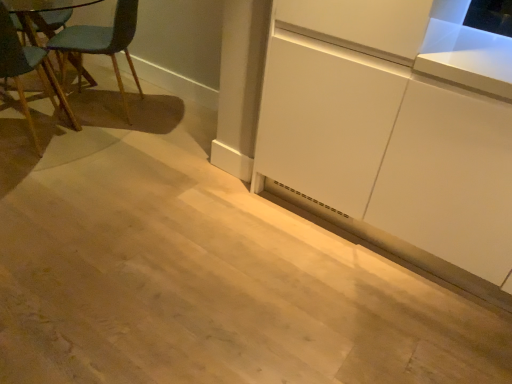
The image size is (512, 384). What do you see at coordinates (386, 140) in the screenshot?
I see `white matte cabinet at lower right` at bounding box center [386, 140].

Identify the location of white matte cabinet at lower right. The height and width of the screenshot is (384, 512). (386, 140).

Identify the location of teal fabric chair at left. (99, 45).

What do you see at coordinates (99, 45) in the screenshot?
I see `teal fabric chair at left` at bounding box center [99, 45].

I want to click on white matte cabinet at lower right, so click(x=386, y=140).

Is teal fabric chair at left to the left of white matte cabinet at lower right from the viewer's perspective?

Yes, teal fabric chair at left is to the left of white matte cabinet at lower right.

Which object is closer to the camera taking this photo, teal fabric chair at left or white matte cabinet at lower right?

white matte cabinet at lower right.

Is point (133, 17) closer to camera compared to point (394, 140)?

No, (133, 17) is further to viewer.

From the image's perspective, between teal fabric chair at left and white matte cabinet at lower right, who is located below?

white matte cabinet at lower right.

From a real-world perspective, relative to white matte cabinet at lower right, is teal fabric chair at left vertically above or below?

teal fabric chair at left is below white matte cabinet at lower right.

Is teal fabric chair at left thinner than white matte cabinet at lower right?

No.

Does teal fabric chair at left have a greater height compared to white matte cabinet at lower right?

In fact, teal fabric chair at left may be shorter than white matte cabinet at lower right.

Is teal fabric chair at left bigger or smaller than white matte cabinet at lower right?

teal fabric chair at left is bigger than white matte cabinet at lower right.

Looking at this image, can we say teal fabric chair at left lies outside white matte cabinet at lower right?

Yes.

Is teal fabric chair at left touching white matte cabinet at lower right?

No, teal fabric chair at left is not making contact with white matte cabinet at lower right.

Is teal fabric chair at left aimed at white matte cabinet at lower right?

No, teal fabric chair at left does not turn towards white matte cabinet at lower right.

How distant is teal fabric chair at left from white matte cabinet at lower right?

A distance of 5.09 feet exists between teal fabric chair at left and white matte cabinet at lower right.

In the image, there is a white matte cabinet at lower right. Where is `chair above it (from the image's perspective)`? This screenshot has width=512, height=384. chair above it (from the image's perspective) is located at coordinates (99, 45).

Considering the positions of objects white matte cabinet at lower right and teal fabric chair at left in the image provided, who is more to the right, white matte cabinet at lower right or teal fabric chair at left?

From the viewer's perspective, white matte cabinet at lower right appears more on the right side.

Considering the relative positions of white matte cabinet at lower right and teal fabric chair at left in the image provided, is white matte cabinet at lower right behind teal fabric chair at left?

No, it is not.

Based on the photo, which point is more forward, (422,11) or (59,67)?

The point (422,11) is in front.

From the image's perspective, is white matte cabinet at lower right located above or below teal fabric chair at left?

white matte cabinet at lower right is below teal fabric chair at left.

From a real-world perspective, who is located higher, white matte cabinet at lower right or teal fabric chair at left?

From a 3D spatial view, white matte cabinet at lower right is above.

Is white matte cabinet at lower right wider or thinner than teal fabric chair at left?

Considering their sizes, white matte cabinet at lower right looks slimmer than teal fabric chair at left.

Can you confirm if white matte cabinet at lower right is taller than teal fabric chair at left?

Correct, white matte cabinet at lower right is much taller as teal fabric chair at left.

Considering the relative sizes of white matte cabinet at lower right and teal fabric chair at left in the image provided, is white matte cabinet at lower right bigger than teal fabric chair at left?

Incorrect, white matte cabinet at lower right is not larger than teal fabric chair at left.

Which is correct: white matte cabinet at lower right is inside teal fabric chair at left, or outside of it?

white matte cabinet at lower right is outside teal fabric chair at left.

Is white matte cabinet at lower right next to teal fabric chair at left?

They are not placed beside each other.

Consider the image. Does white matte cabinet at lower right turn towards teal fabric chair at left?

No, white matte cabinet at lower right is not turned towards teal fabric chair at left.

Image resolution: width=512 pixels, height=384 pixels. What are the coordinates of `chair located underneath the white matte cabinet at lower right (from a real-world perspective)` in the screenshot? It's located at (99, 45).

Locate an element on the screen. The width and height of the screenshot is (512, 384). chair to the left of white matte cabinet at lower right is located at coordinates (99, 45).

The height and width of the screenshot is (384, 512). Find the location of `chair beneath the white matte cabinet at lower right (from a real-world perspective)`. chair beneath the white matte cabinet at lower right (from a real-world perspective) is located at coordinates (99, 45).